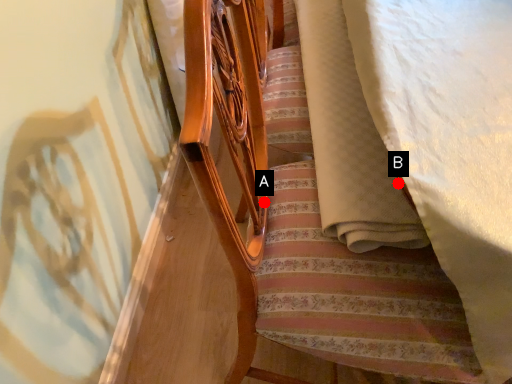
Question: Two points are circled on the image, labeled by A and B beside each circle. Which point is closer to the camera?

Choices:
 (A) A is closer
 (B) B is closer

Answer: (B)